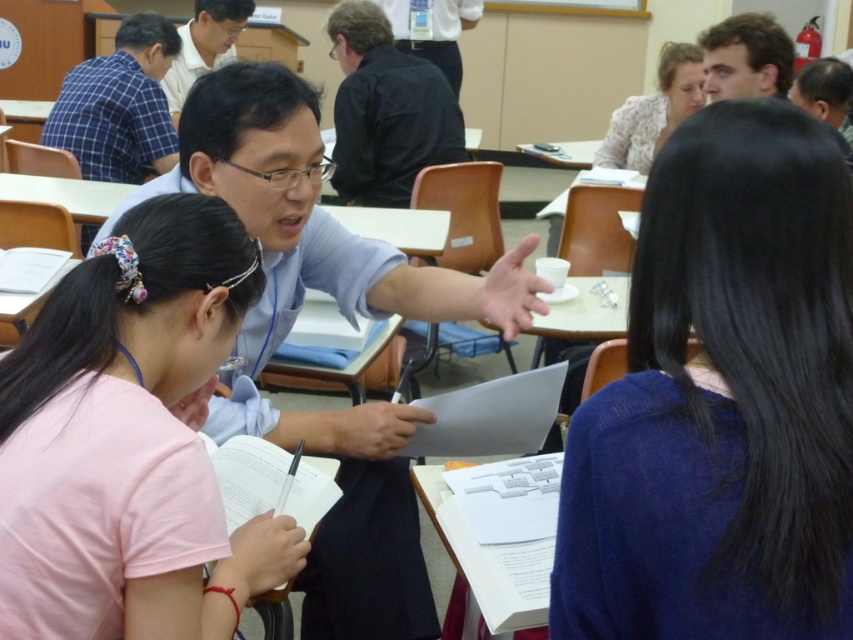
Between pink fabric shirt at upper left and black shirt at upper center, which one is positioned higher?

black shirt at upper center is above.

Is pink fabric shirt at upper left shorter than black shirt at upper center?

No.

The image size is (853, 640). Describe the element at coordinates (131, 440) in the screenshot. I see `pink fabric shirt at upper left` at that location.

This screenshot has height=640, width=853. What are the coordinates of `pink fabric shirt at upper left` in the screenshot? It's located at (131, 440).

Who is positioned more to the right, smooth brown hair at upper right or matte black shirt at upper center?

Positioned to the right is smooth brown hair at upper right.

Does point (721, 29) come farther from viewer compared to point (244, 12)?

No.

Is point (746, 93) closer to viewer compared to point (165, 84)?

Yes, it is in front of point (165, 84).

What are the coordinates of `smooth brown hair at upper right` in the screenshot? It's located at (746, 58).

Can you confirm if blue checkered shirt at upper left is shorter than black shirt at upper center?

No.

Is point (154, 32) more distant than point (421, 3)?

No, it is not.

Where is `blue checkered shirt at upper left`? Image resolution: width=853 pixels, height=640 pixels. blue checkered shirt at upper left is located at coordinates (119, 106).